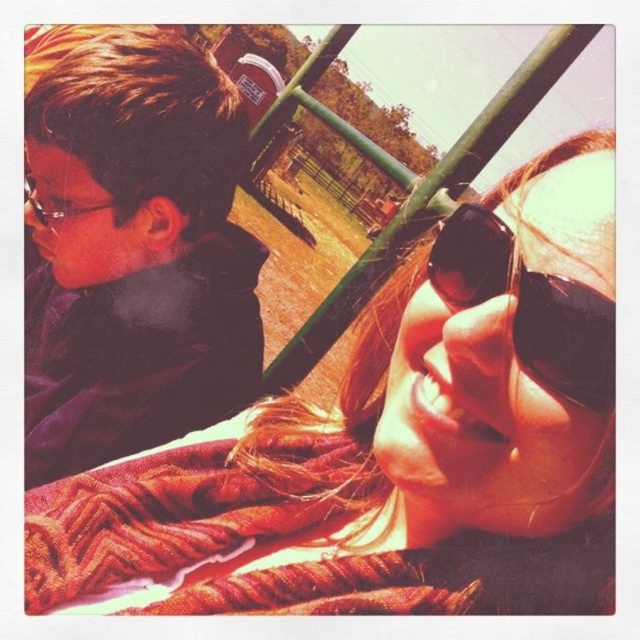
You are taking a photo of the two people in the scene. You want to focus on the person on the right first. Which point, point (577,403) or point (170,532), should you adjust your camera focus to first?

Point (577,403) is closer to the camera than point (170,532). Therefore, to focus on the person on the right first, you should adjust your camera focus to point (577,403) first.

You are a photographer trying to capture a closeup of the black reflective sunglasses at upper right. However, the knitted wool scarf at lower center is blocking your view. Can you determine which object is positioned to the left of the other?

The knitted wool scarf at lower center is to the left of the black reflective sunglasses at upper right, so the scarf is blocking the view of the sunglasses.

You are a photographer trying to capture the person in the matte black jacket at left. You want to focus on the point at coordinates point (132,248). Is this point located on the matte black jacket at left?

Yes, the point (132,248) is on the matte black jacket at left according to the description.